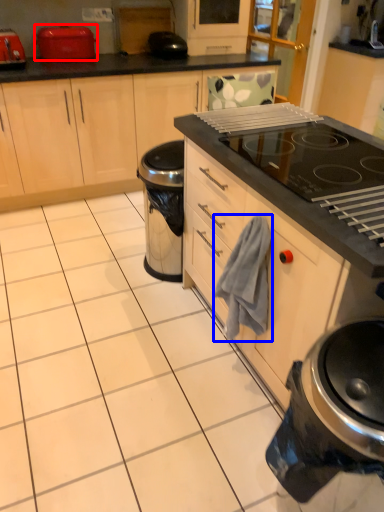
Question: Which point is closer to the camera, kitchen appliance (highlighted by a red box) or hand towel (highlighted by a blue box)?

Choices:
 (A) kitchen appliance
 (B) hand towel

Answer: (B)